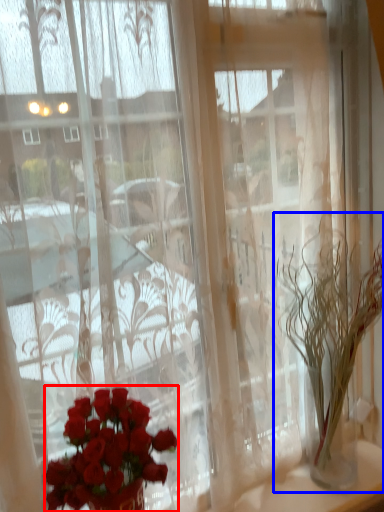
Question: Which point is closer to the camera, flower (highlighted by a red box) or houseplant (highlighted by a blue box)?

Choices:
 (A) flower
 (B) houseplant

Answer: (A)